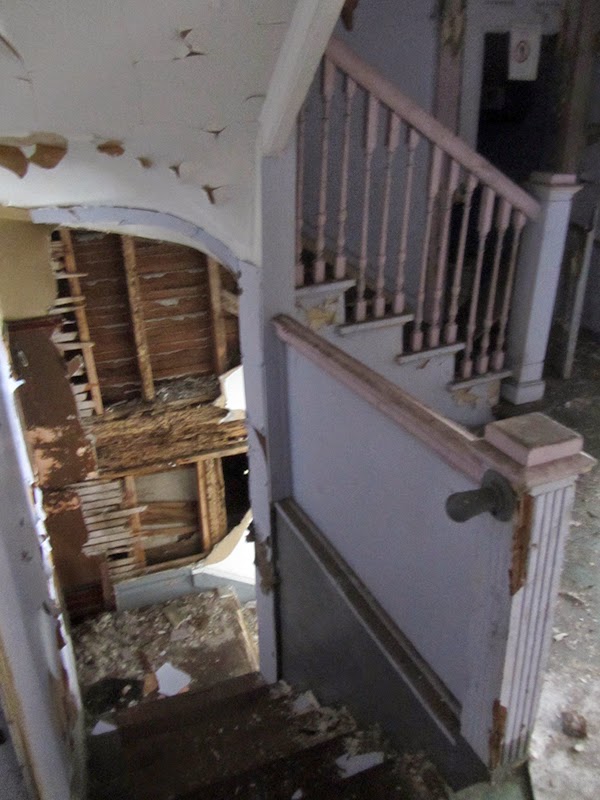
I want to click on trim, so click(570, 470).